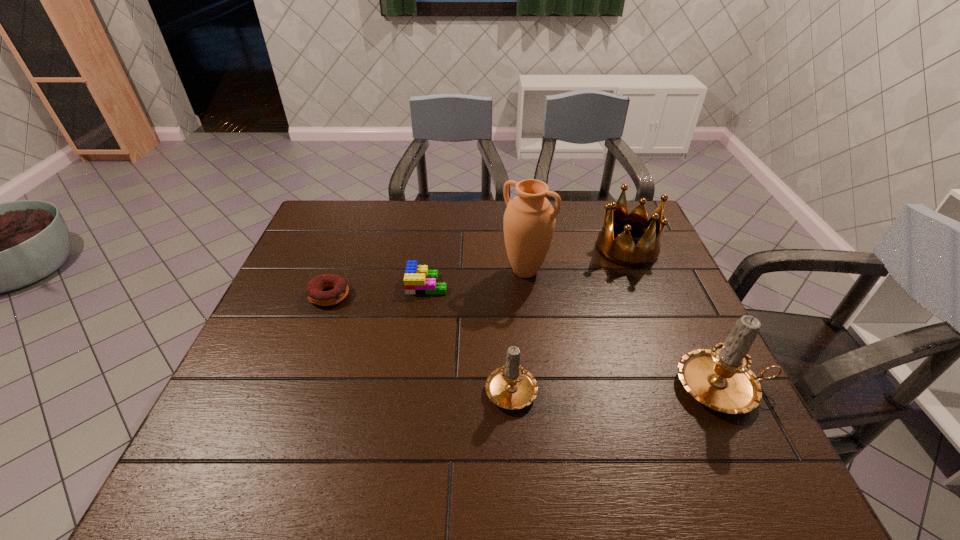
At what (x,y) coordinates should I click in order to perform the action: click on free space located 0.240m on the right of the fourth tallest object. Please return your answer as a coordinate pair (x, y). This screenshot has height=540, width=960. Looking at the image, I should click on (643, 387).

Identify the location of blank space located 0.300m on the left of the second tallest object. (543, 387).

This screenshot has height=540, width=960. I want to click on free space located 0.240m on the back of the fifth object from right to left, so click(x=435, y=227).

Identify the location of vacant region located 0.160m on the front of the third tallest object. The image size is (960, 540). (651, 306).

The height and width of the screenshot is (540, 960). Find the location of `vacant position located on the front of the tallest object`. vacant position located on the front of the tallest object is located at coordinates (531, 320).

Identify the location of free spot located 0.120m on the right of the doughnut. (393, 295).

Locate an element on the screen. The width and height of the screenshot is (960, 540). object present at the far edge is located at coordinates (621, 251).

Identify the location of object that is positioned at the left edge. The width and height of the screenshot is (960, 540). (340, 290).

Locate an element on the screen. candle that is at the right edge is located at coordinates (720, 378).

I want to click on crown at the right edge, so click(621, 251).